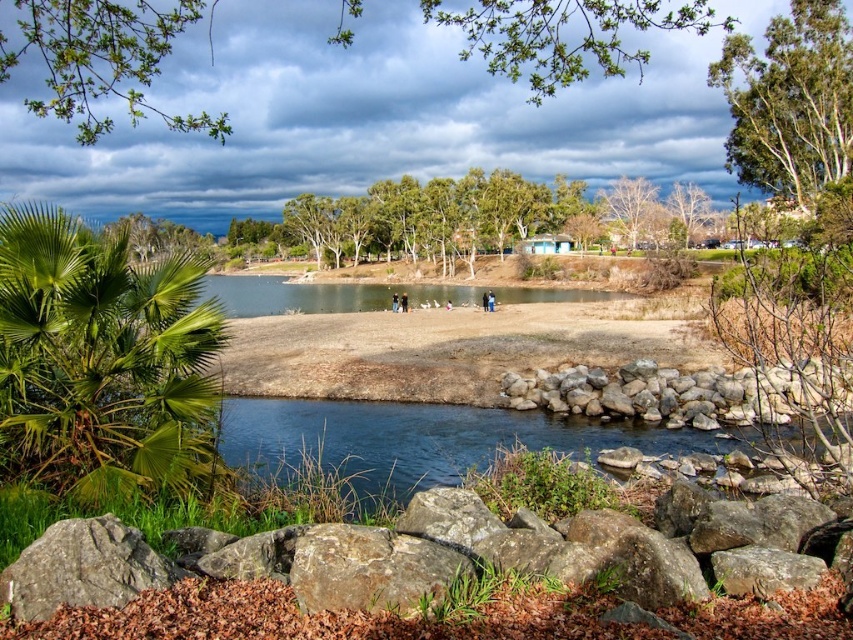
You are standing on the rocky embankment and want to walk towards the green leafy tree at upper right. Which direction should you move relative to the green leafy branches at upper center?

You should move towards the right side of the green leafy branches at upper center to reach the green leafy tree at upper right since the branches are closer to you and the tree is further away.

You are a bird looking for a place to perch. You see the green leafy branches at upper center and the gray rock wall at lower center. Which location would allow you to perch higher above the ground?

The green leafy branches at upper center would allow you to perch higher above the ground since they are much taller than the gray rock wall at lower center.